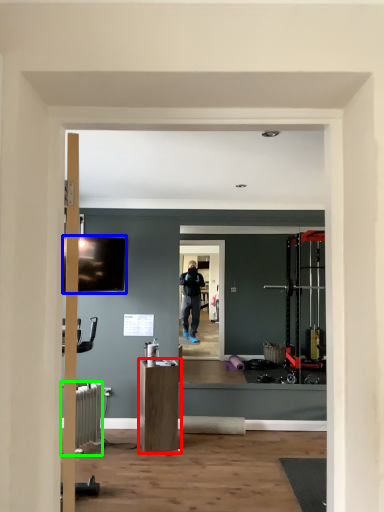
Question: Considering the real-world distances, which object is closest to furniture (highlighted by a red box)? television (highlighted by a blue box) or radiator (highlighted by a green box).

Choices:
 (A) television
 (B) radiator

Answer: (B)